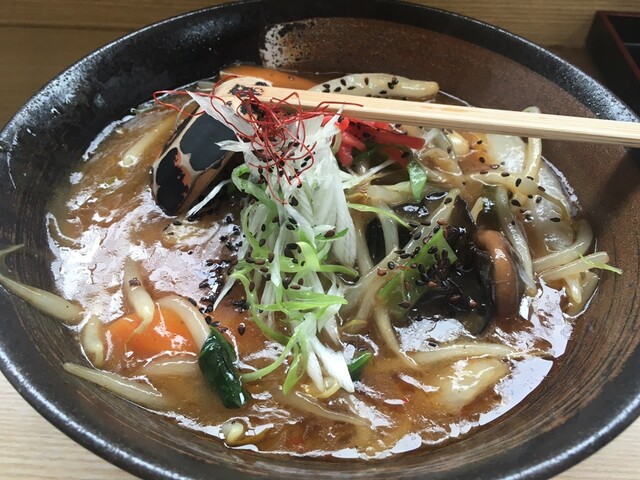
At what (x,y) coordinates should I click in order to perform the action: click on bowl. Please return your answer as a coordinate pair (x, y). Image resolution: width=640 pixels, height=480 pixels. Looking at the image, I should click on (175, 59).